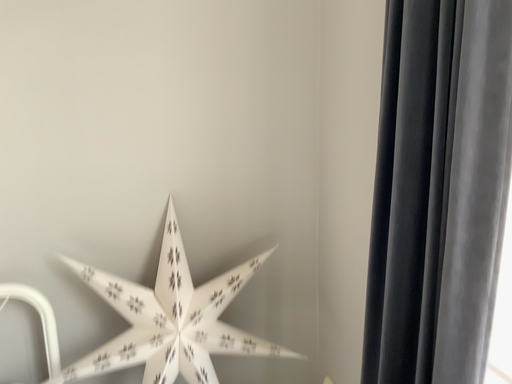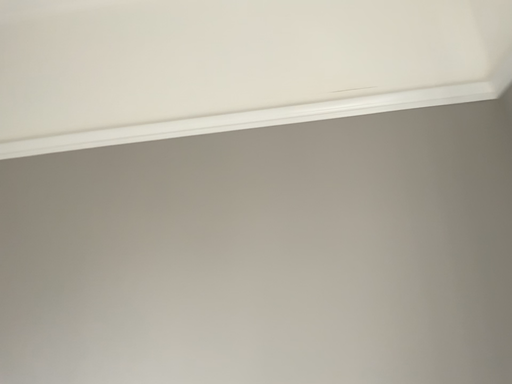
Question: Which way did the camera rotate in the video?

Choices:
 (A) rotated downward
 (B) rotated upward

Answer: (B)